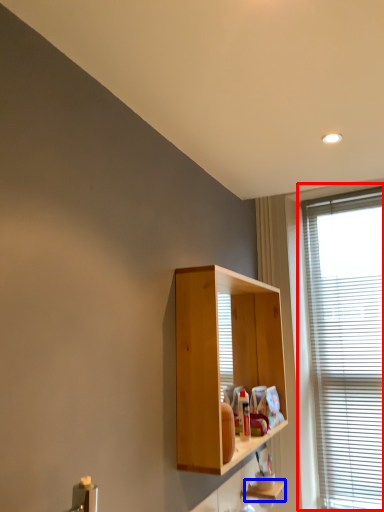
Question: Which point is closer to the camera, window (highlighted by a red box) or shelf (highlighted by a blue box)?

Choices:
 (A) window
 (B) shelf

Answer: (B)